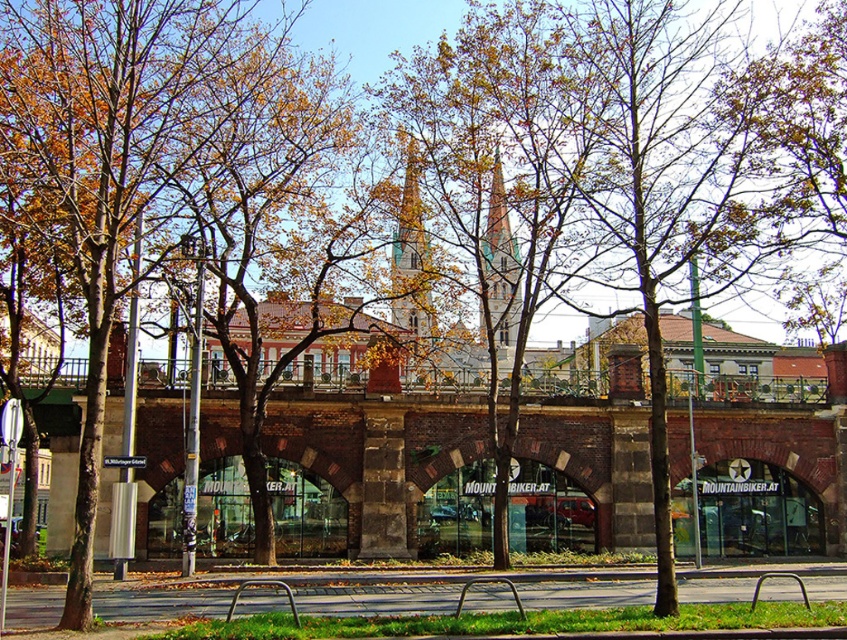
You are a tourist visiting the area and want to take a photo that includes both the green stone tower at center and the metallic silver bench at center. Which object should you position closer to the camera to ensure both fit in the frame?

To ensure both the green stone tower at center and the metallic silver bench at center fit in the frame, position the metallic silver bench at center closer to the camera since it is smaller than the green stone tower at center.

You are standing at the stone bridge and looking towards the storefronts. There are two points marked in the scene. Which point, point (410, 294) or point (499, 200), is closer to you?

Point (410, 294) is closer to you because it is in front of point (499, 200).